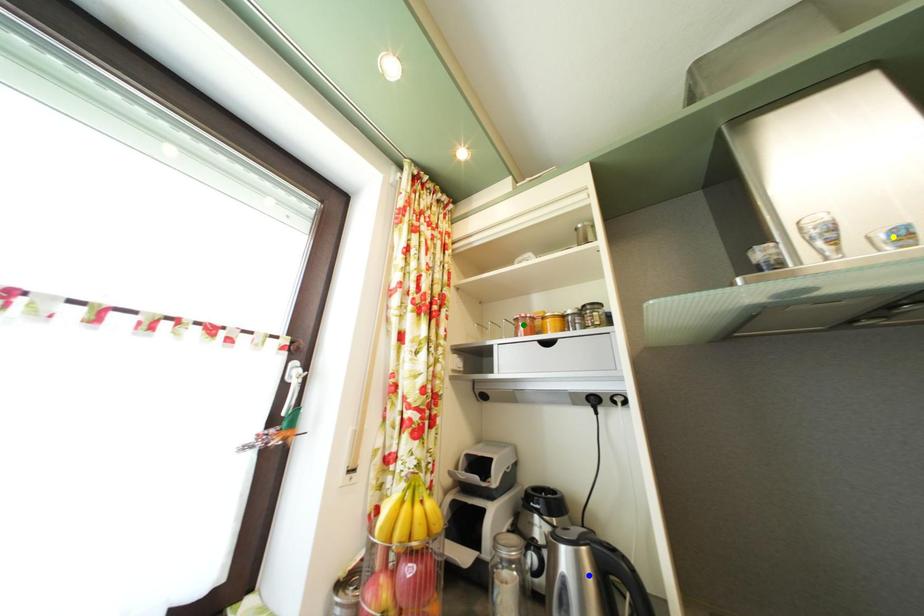
Based on the photo, order these from farthest to nearest:
- green point
- yellow point
- blue point

green point, blue point, yellow point